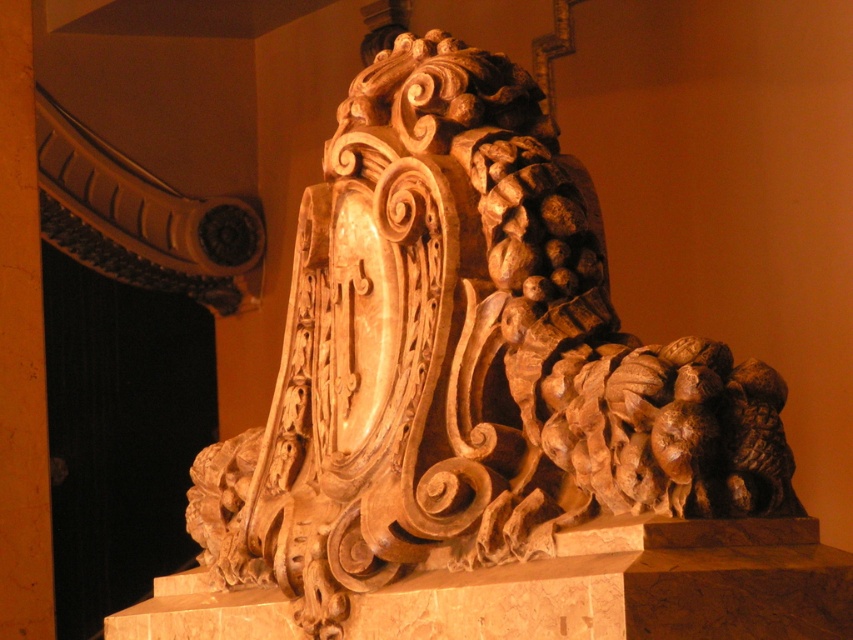
Can you confirm if wooden carving at center is thinner than orange polished wood at upper left?

In fact, wooden carving at center might be wider than orange polished wood at upper left.

Does wooden carving at center appear on the left side of orange polished wood at upper left?

In fact, wooden carving at center is to the right of orange polished wood at upper left.

Does point (585, 292) lie in front of point (18, 48)?

Yes, point (585, 292) is closer to viewer.

Where is `wooden carving at center`? The image size is (853, 640). wooden carving at center is located at coordinates (465, 362).